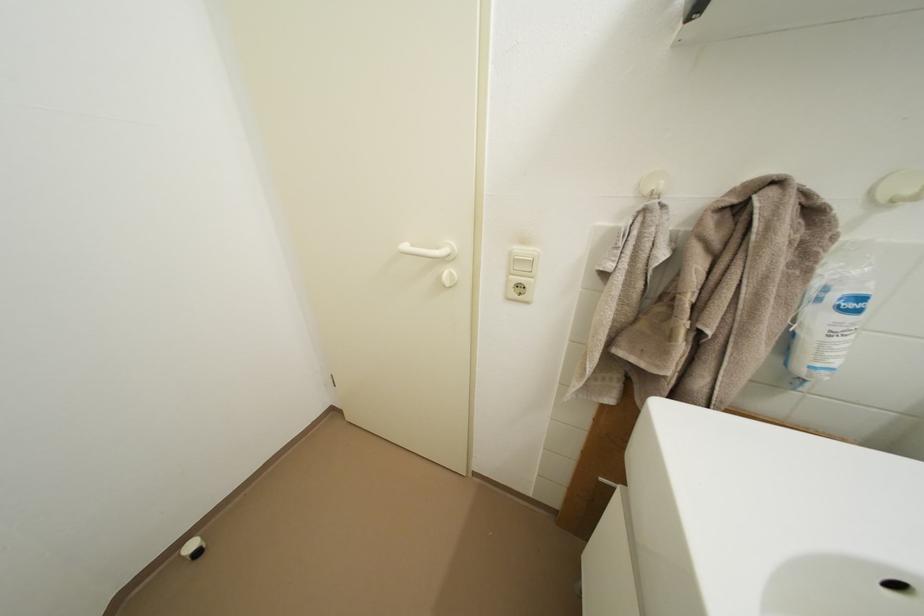
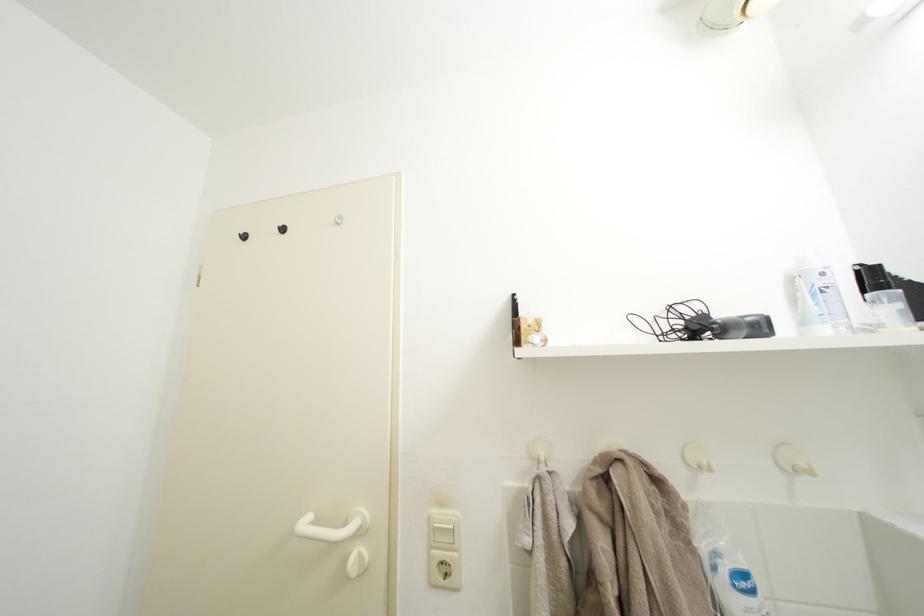
The point at (517, 286) is marked in the first image. Where is the corresponding point in the second image?

(439, 562)